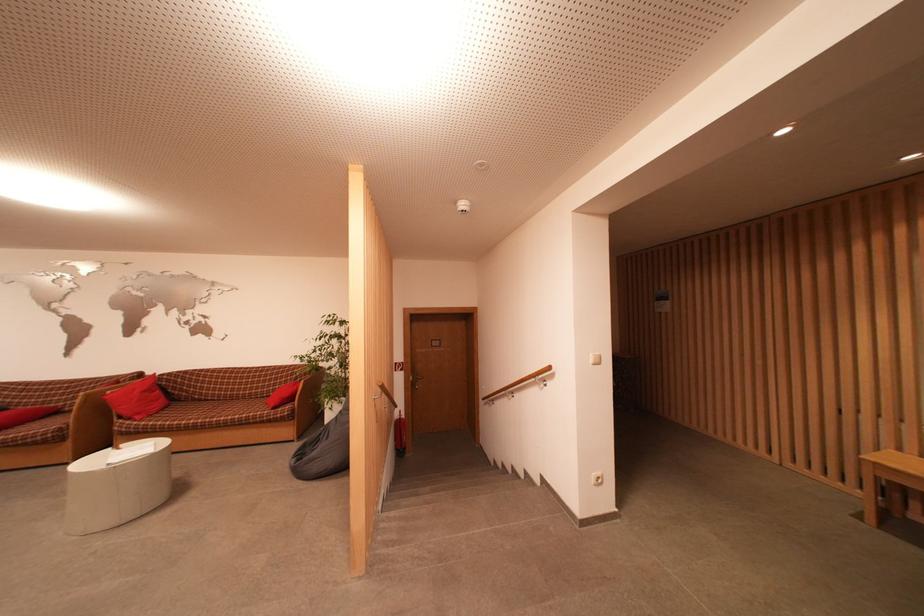
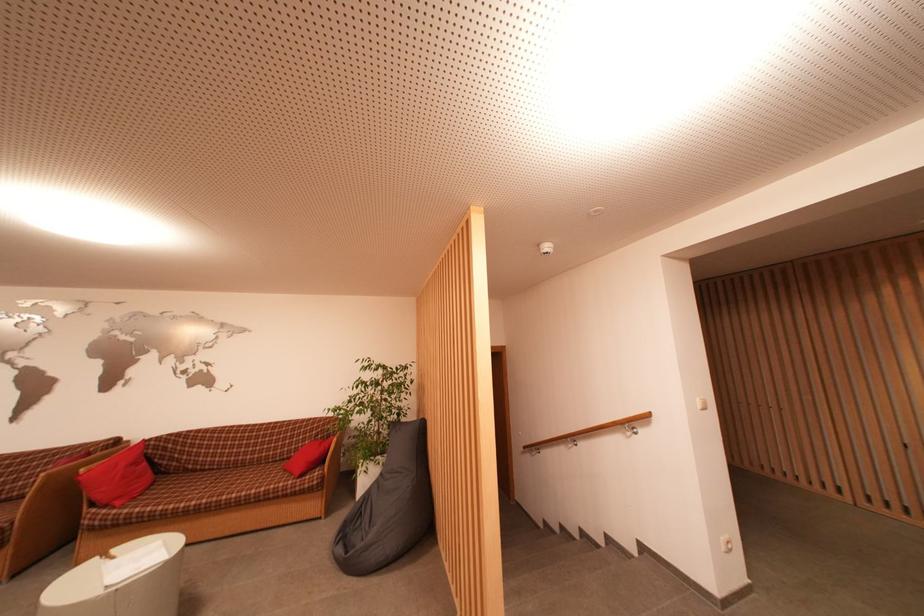
Find the pixel in the second image that matches (x=162, y=395) in the first image.

(149, 467)